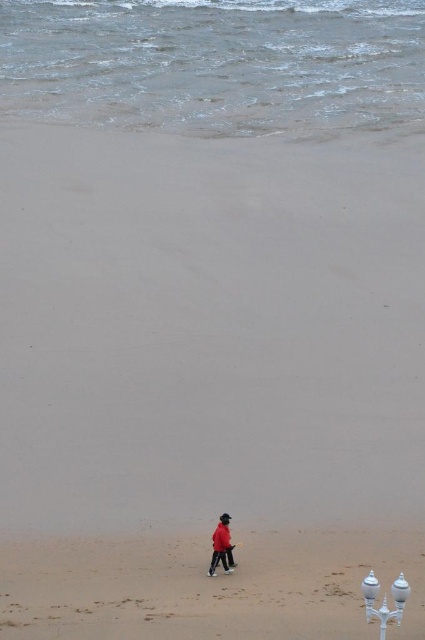
Based on the photo, you are a photographer trying to capture the matte red jacket at lower center and the sandy beach at lower center in a single frame. Which object appears wider in the photo?

The matte red jacket at lower center appears wider in the photo because the sandy beach at lower center is thinner than it.

You are standing on the beach and see the point marked at coordinates (206, 588). According to the image, what is located at that point?

The point at coordinates (206, 588) indicates the sandy beach at lower center.